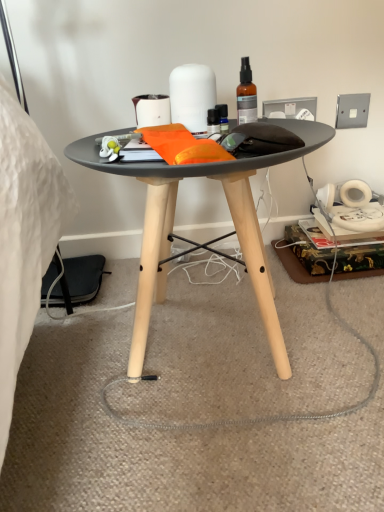
What is the approximate width of translucent amber glass spray bottle at upper center?

2.04 inches.

Image resolution: width=384 pixels, height=512 pixels. What do you see at coordinates (246, 94) in the screenshot?
I see `translucent amber glass spray bottle at upper center` at bounding box center [246, 94].

What is the approximate width of matte black table at center?

matte black table at center is 18.40 inches in width.

The width and height of the screenshot is (384, 512). Describe the element at coordinates (173, 225) in the screenshot. I see `matte black table at center` at that location.

Find the location of `translucent amber glass spray bottle at upper center`. translucent amber glass spray bottle at upper center is located at coordinates (246, 94).

Who is taller, matte white toilet paper at upper center, arranged as the 2th toilet paper when viewed from the right, or translucent amber glass spray bottle at upper center?

translucent amber glass spray bottle at upper center is taller.

Is matte white toilet paper at upper center, which is the 1th toilet paper from left to right, positioned far away from translucent amber glass spray bottle at upper center?

Actually, matte white toilet paper at upper center, which is the 1th toilet paper from left to right, and translucent amber glass spray bottle at upper center are a little close together.

Which is more to the left, matte white toilet paper at upper center, which is the 1th toilet paper from left to right, or translucent amber glass spray bottle at upper center?

From the viewer's perspective, matte white toilet paper at upper center, which is the 1th toilet paper from left to right, appears more on the left side.

In the scene shown: From a real-world perspective, does matte white toilet paper at upper center, which is the 1th toilet paper from left to right, sit lower than translucent amber glass spray bottle at upper center?

Correct, in the physical world, matte white toilet paper at upper center, which is the 1th toilet paper from left to right, is lower than translucent amber glass spray bottle at upper center.

From a real-world perspective, is matte white toilet paper at upper center, arranged as the 2th toilet paper when viewed from the right, physically located above or below matte black table at center?

matte white toilet paper at upper center, arranged as the 2th toilet paper when viewed from the right, is situated higher than matte black table at center in the real world.

Is matte white toilet paper at upper center, which is the 1th toilet paper from left to right, at the left side of matte black table at center?

Indeed, matte white toilet paper at upper center, which is the 1th toilet paper from left to right, is positioned on the left side of matte black table at center.

Could matte black table at center be considered to be inside matte white toilet paper at upper center, which is the 1th toilet paper from left to right?

No.

Which object is further away from the camera, matte white toilet paper at upper center, which is the 1th toilet paper from left to right, or matte black table at center?

matte white toilet paper at upper center, which is the 1th toilet paper from left to right.

Which object is more forward, white matte diffuser at upper center, the 2th toilet paper when ordered from left to right, or translucent amber glass spray bottle at upper center?

translucent amber glass spray bottle at upper center.

Considering the positions of point (186, 101) and point (239, 84), is point (186, 101) closer or farther from the camera than point (239, 84)?

Point (186, 101) is positioned closer to the camera compared to point (239, 84).

Are white matte diffuser at upper center, which is the first toilet paper in right-to-left order, and translucent amber glass spray bottle at upper center located far from each other?

No, white matte diffuser at upper center, which is the first toilet paper in right-to-left order, is not far away from translucent amber glass spray bottle at upper center.

Measure the distance from white matte diffuser at upper center, the 2th toilet paper when ordered from left to right, to matte black table at center.

white matte diffuser at upper center, the 2th toilet paper when ordered from left to right, and matte black table at center are 9.40 inches apart from each other.

From the image's perspective, is white matte diffuser at upper center, which is the first toilet paper in right-to-left order, above or below matte black table at center?

A: Based on their image positions, white matte diffuser at upper center, which is the first toilet paper in right-to-left order, is located above matte black table at center.

In the scene shown: From a real-world perspective, is white matte diffuser at upper center, the 2th toilet paper when ordered from left to right, positioned under matte black table at center based on gravity?

Incorrect, from a real-world perspective, white matte diffuser at upper center, the 2th toilet paper when ordered from left to right, is higher than matte black table at center.

Does white matte diffuser at upper center, the 2th toilet paper when ordered from left to right, have a lesser height compared to matte black table at center?

Correct, white matte diffuser at upper center, the 2th toilet paper when ordered from left to right, is not as tall as matte black table at center.

Between point (254, 100) and point (166, 96), which one is positioned behind?

Point (166, 96)

Can you confirm if translucent amber glass spray bottle at upper center is thinner than matte white toilet paper at upper center, arranged as the 2th toilet paper when viewed from the right?

Indeed, translucent amber glass spray bottle at upper center has a lesser width compared to matte white toilet paper at upper center, arranged as the 2th toilet paper when viewed from the right.

From a real-world perspective, which object rests below the other?

matte white toilet paper at upper center, arranged as the 2th toilet paper when viewed from the right, is physically lower.

In the scene shown: Is matte white toilet paper at upper center, arranged as the 2th toilet paper when viewed from the right, located within white matte diffuser at upper center, the 2th toilet paper when ordered from left to right?

No, matte white toilet paper at upper center, arranged as the 2th toilet paper when viewed from the right, is located outside of white matte diffuser at upper center, the 2th toilet paper when ordered from left to right.

Considering the sizes of objects white matte diffuser at upper center, the 2th toilet paper when ordered from left to right, and matte white toilet paper at upper center, arranged as the 2th toilet paper when viewed from the right, in the image provided, who is wider, white matte diffuser at upper center, the 2th toilet paper when ordered from left to right, or matte white toilet paper at upper center, arranged as the 2th toilet paper when viewed from the right,?

white matte diffuser at upper center, the 2th toilet paper when ordered from left to right, is wider.

Is white matte diffuser at upper center, the 2th toilet paper when ordered from left to right, at the left side of matte white toilet paper at upper center, arranged as the 2th toilet paper when viewed from the right?

In fact, white matte diffuser at upper center, the 2th toilet paper when ordered from left to right, is to the right of matte white toilet paper at upper center, arranged as the 2th toilet paper when viewed from the right.

Is white matte diffuser at upper center, the 2th toilet paper when ordered from left to right, positioned far away from matte white toilet paper at upper center, which is the 1th toilet paper from left to right?

They are positioned close to each other.

Is translucent amber glass spray bottle at upper center aimed at matte black table at center?

No, translucent amber glass spray bottle at upper center is not oriented towards matte black table at center.

Would you say translucent amber glass spray bottle at upper center is outside matte black table at center?

Yes, translucent amber glass spray bottle at upper center is located beyond the bounds of matte black table at center.

Is translucent amber glass spray bottle at upper center placed right next to matte black table at center?

No, translucent amber glass spray bottle at upper center is not in contact with matte black table at center.

From the image's perspective, is translucent amber glass spray bottle at upper center above or below matte black table at center?

From the image's perspective, translucent amber glass spray bottle at upper center appears above matte black table at center.

The image size is (384, 512). I want to click on bottle that is above the matte white toilet paper at upper center, arranged as the 2th toilet paper when viewed from the right (from a real-world perspective), so click(246, 94).

This screenshot has width=384, height=512. I want to click on toilet paper that is the 2nd object located behind the matte black table at center, so click(151, 110).

Looking at the image, which one is located further to matte black table at center, white matte diffuser at upper center, which is the first toilet paper in right-to-left order, or translucent amber glass spray bottle at upper center?

translucent amber glass spray bottle at upper center.

From the image, which object appears to be nearer to white matte diffuser at upper center, the 2th toilet paper when ordered from left to right, matte white toilet paper at upper center, arranged as the 2th toilet paper when viewed from the right, or matte black table at center?

Based on the image, matte white toilet paper at upper center, arranged as the 2th toilet paper when viewed from the right, appears to be nearer to white matte diffuser at upper center, the 2th toilet paper when ordered from left to right.

From the image, which object appears to be farther from matte black table at center, matte white toilet paper at upper center, which is the 1th toilet paper from left to right, or white matte diffuser at upper center, which is the first toilet paper in right-to-left order?

The object further to matte black table at center is matte white toilet paper at upper center, which is the 1th toilet paper from left to right.

Based on their spatial positions, is matte white toilet paper at upper center, arranged as the 2th toilet paper when viewed from the right, or matte black table at center closer to translucent amber glass spray bottle at upper center?

matte white toilet paper at upper center, arranged as the 2th toilet paper when viewed from the right, is positioned closer to the anchor translucent amber glass spray bottle at upper center.

Looking at the image, which one is located closer to white matte diffuser at upper center, which is the first toilet paper in right-to-left order, translucent amber glass spray bottle at upper center or matte white toilet paper at upper center, which is the 1th toilet paper from left to right?

matte white toilet paper at upper center, which is the 1th toilet paper from left to right, lies closer to white matte diffuser at upper center, which is the first toilet paper in right-to-left order, than the other object.

Looking at the image, which one is located closer to white matte diffuser at upper center, the 2th toilet paper when ordered from left to right, matte black table at center or translucent amber glass spray bottle at upper center?

translucent amber glass spray bottle at upper center.

Which object lies further to the anchor point white matte diffuser at upper center, which is the first toilet paper in right-to-left order, matte white toilet paper at upper center, which is the 1th toilet paper from left to right, or translucent amber glass spray bottle at upper center?

The object further to white matte diffuser at upper center, which is the first toilet paper in right-to-left order, is translucent amber glass spray bottle at upper center.

Estimate the real-world distances between objects in this image. Which object is further from matte white toilet paper at upper center, which is the 1th toilet paper from left to right, white matte diffuser at upper center, which is the first toilet paper in right-to-left order, or translucent amber glass spray bottle at upper center?

translucent amber glass spray bottle at upper center is positioned further to the anchor matte white toilet paper at upper center, which is the 1th toilet paper from left to right.

The height and width of the screenshot is (512, 384). Find the location of `toilet paper between translucent amber glass spray bottle at upper center and matte black table at center in the up-down direction`. toilet paper between translucent amber glass spray bottle at upper center and matte black table at center in the up-down direction is located at coordinates (151, 110).

Identify the location of toilet paper between white matte diffuser at upper center, the 2th toilet paper when ordered from left to right, and matte black table at center vertically. (151, 110).

Where is `toilet paper situated between matte white toilet paper at upper center, arranged as the 2th toilet paper when viewed from the right, and translucent amber glass spray bottle at upper center from left to right`? This screenshot has height=512, width=384. toilet paper situated between matte white toilet paper at upper center, arranged as the 2th toilet paper when viewed from the right, and translucent amber glass spray bottle at upper center from left to right is located at coordinates (192, 96).

Identify the location of bottle between white matte diffuser at upper center, the 2th toilet paper when ordered from left to right, and matte black table at center from top to bottom. pos(246,94).